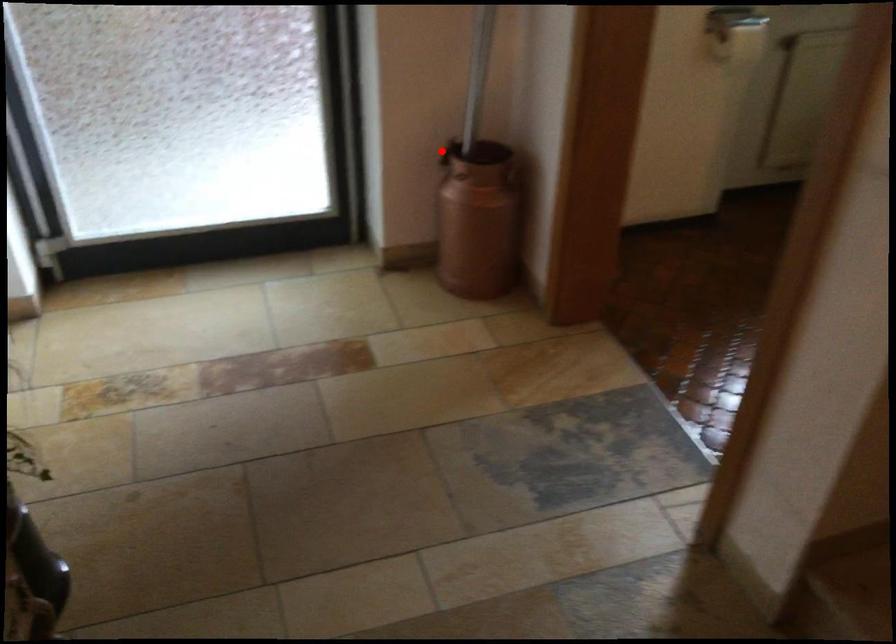
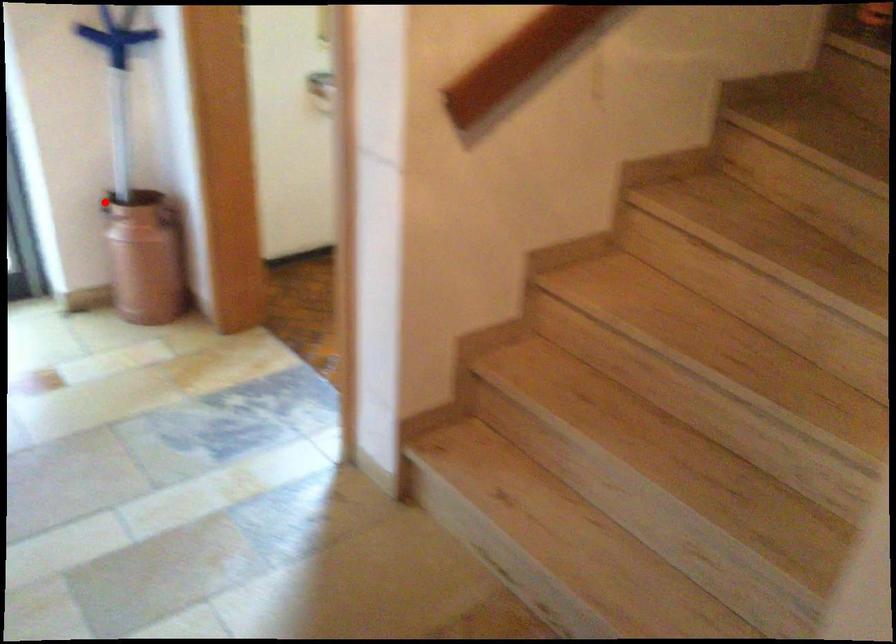
I am providing you with two images of the same scene from different viewpoints. A red point is marked on the first image and another point is marked on the second image. Are the points marked in image1 and image2 representing the same 3D position?

Yes